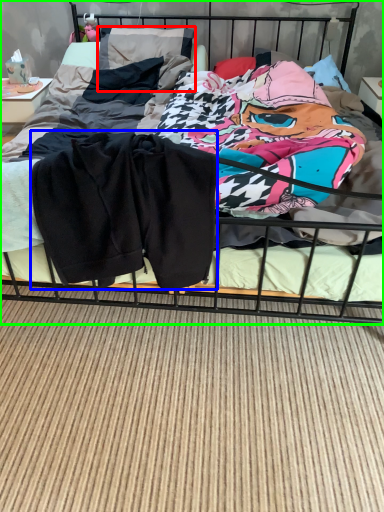
Question: Based on their relative distances, which object is farther from pillow (highlighted by a red box)? Choose from baby clothe (highlighted by a blue box) and bed (highlighted by a green box).

Choices:
 (A) baby clothe
 (B) bed

Answer: (A)